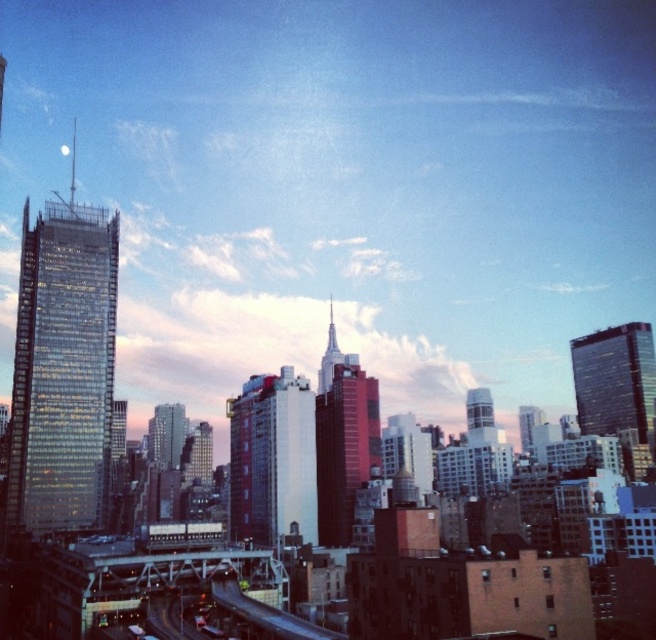
Locate an element on the screen. glassy reflective skyscraper at left is located at coordinates (64, 368).

Is glassy reflective skyscraper at left below glassy reflective skyscraper at upper center?

Actually, glassy reflective skyscraper at left is above glassy reflective skyscraper at upper center.

The height and width of the screenshot is (640, 656). Identify the location of glassy reflective skyscraper at left. (64, 368).

The width and height of the screenshot is (656, 640). What are the coordinates of `glassy reflective skyscraper at left` in the screenshot? It's located at [64, 368].

Is red glass skyscraper at center thinner than glassy reflective skyscraper at upper center?

Yes, red glass skyscraper at center is thinner than glassy reflective skyscraper at upper center.

Is red glass skyscraper at center below glassy reflective skyscraper at upper center?

Yes, red glass skyscraper at center is below glassy reflective skyscraper at upper center.

Between point (363, 444) and point (628, 358), which one is positioned in front?

Positioned in front is point (363, 444).

Identify the location of red glass skyscraper at center. (344, 449).

Is glassy reflective skyscraper at left behind red brick building at center?

That is False.

Which is behind, point (10, 484) or point (255, 374)?

Point (255, 374)

Is point (54, 509) closer to viewer compared to point (236, 404)?

Yes, it is.

Locate an element on the screen. This screenshot has width=656, height=640. glassy reflective skyscraper at left is located at coordinates (64, 368).